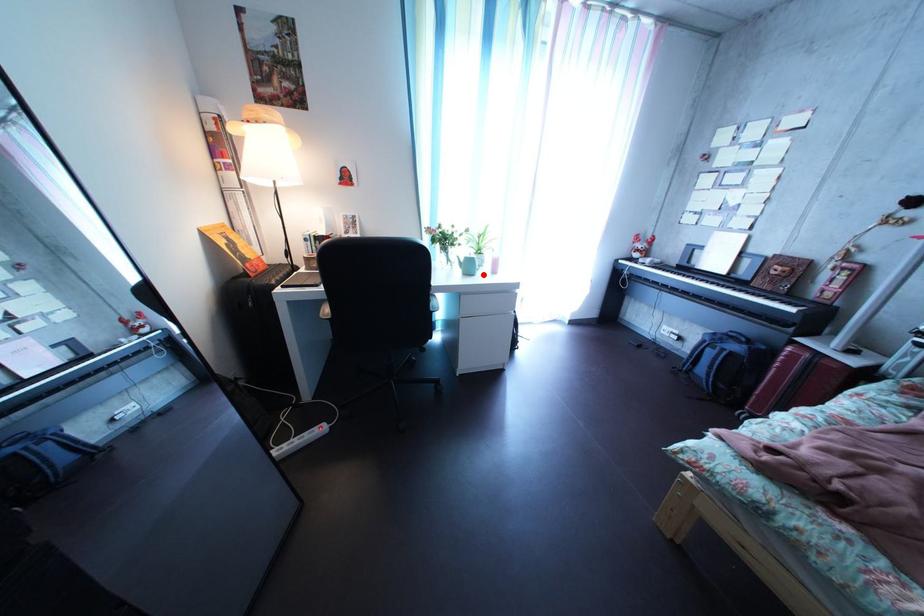
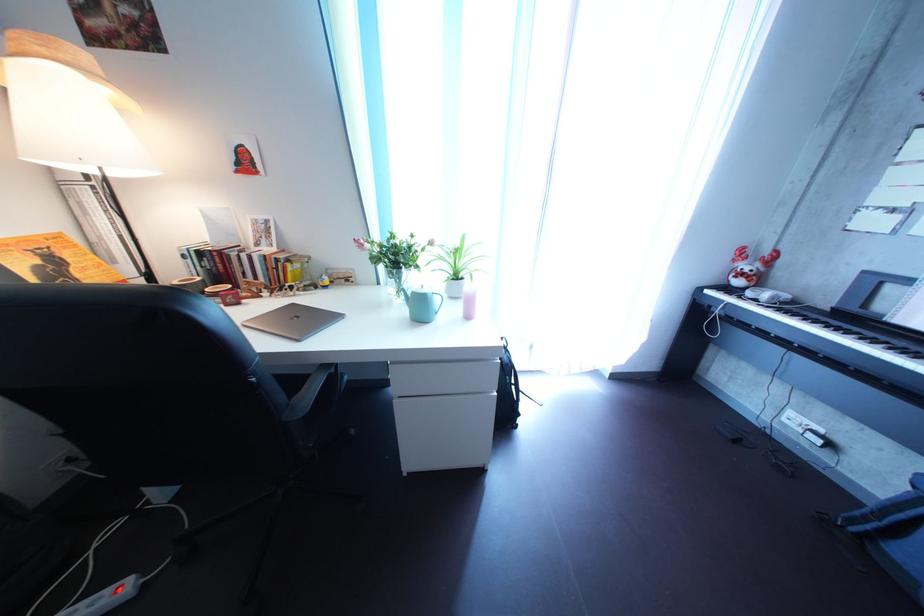
The point at the highlighted location is marked in the first image. Where is the corresponding point in the second image?

(433, 315)